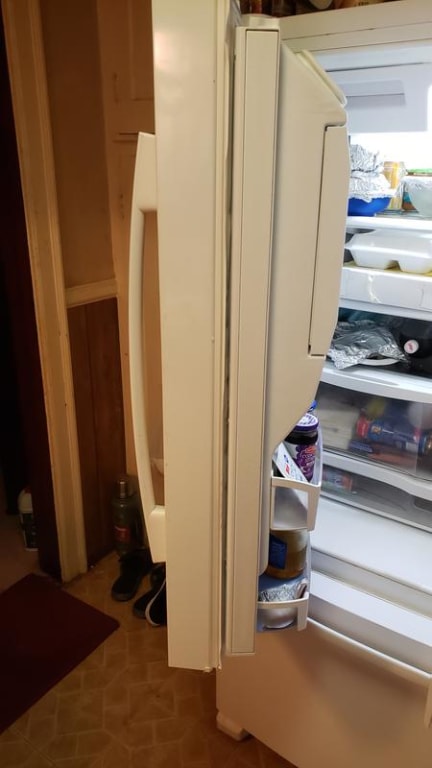
Find the location of a particular element. This screenshot has width=432, height=768. can of biscuits in refrigerator is located at coordinates (386, 435).